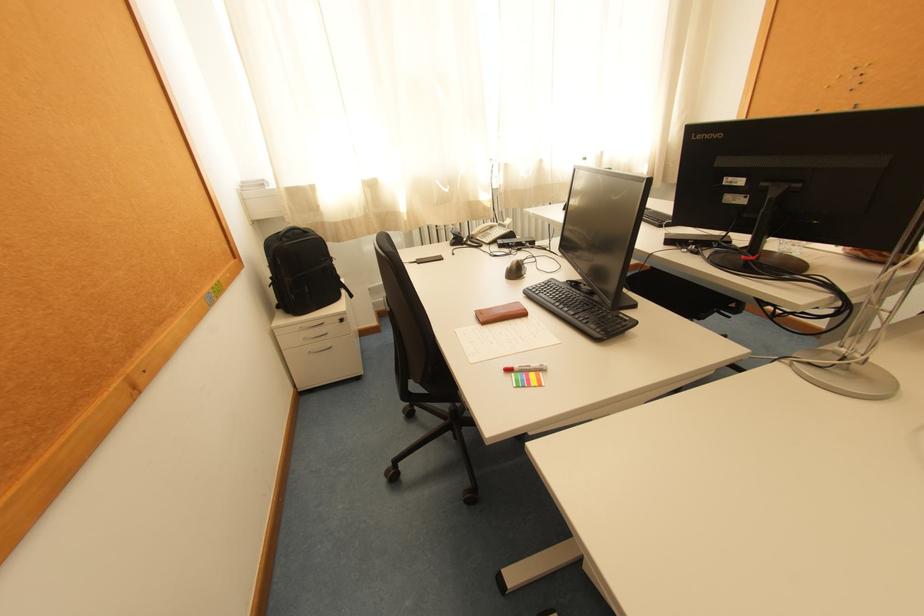
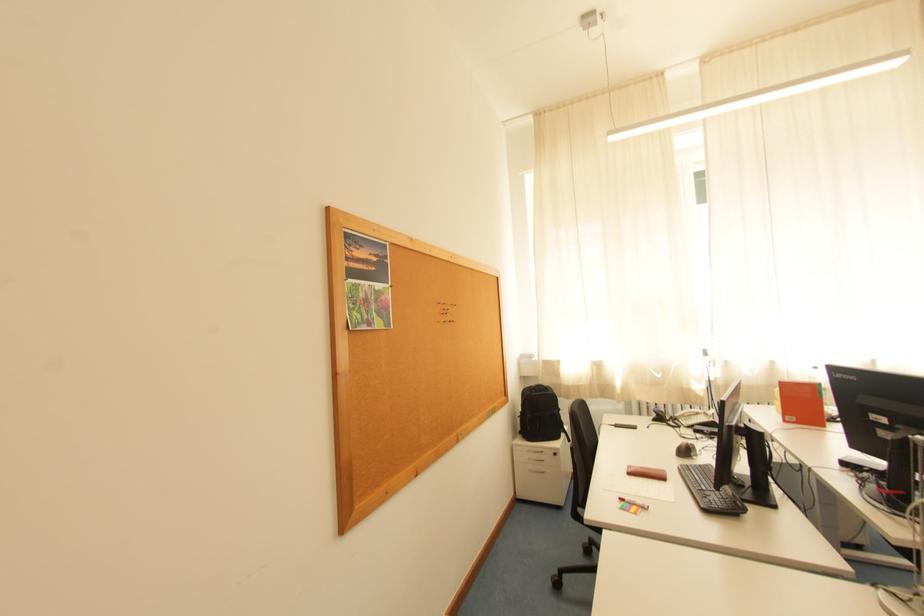
Locate, in the second image, the point that corresponds to pixel 523 268 in the first image.

(691, 448)